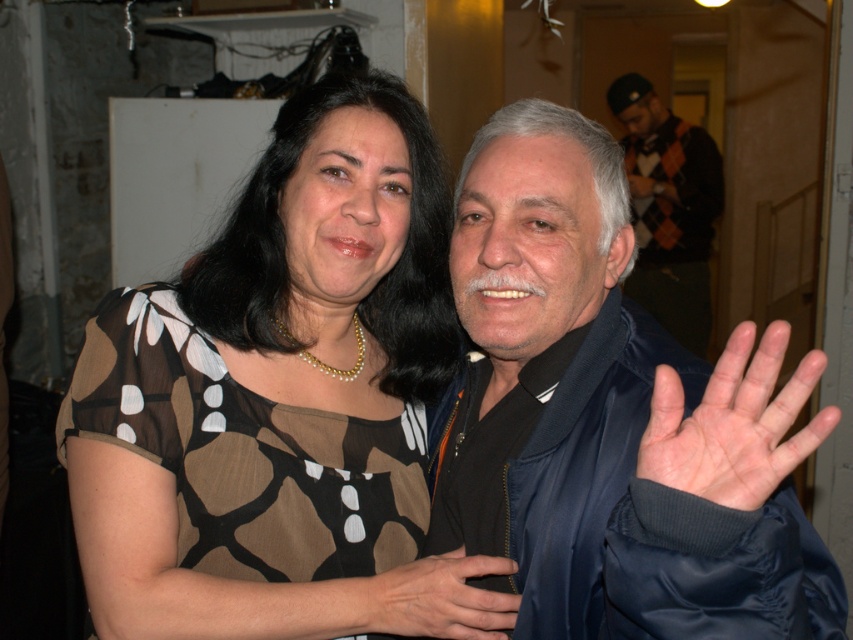
Question: Which object appears farthest from the camera in this image?

Choices:
 (A) brown dotted dress at center
 (B) pale skin palm at center
 (C) satin blue jacket at right
 (D) smooth black hand at center

Answer: (D)

Question: Is pale skin palm at center positioned at the back of argyle sweater at upper right?

Choices:
 (A) yes
 (B) no

Answer: (B)

Question: Which point is closer to the camera?

Choices:
 (A) pale skin palm at center
 (B) smooth black hand at center

Answer: (A)

Question: Does satin blue jacket at right have a larger size compared to argyle sweater at upper right?

Choices:
 (A) yes
 (B) no

Answer: (B)

Question: Which object is positioned farthest from the pale skin palm at center?

Choices:
 (A) satin blue jacket at right
 (B) argyle sweater at upper right
 (C) smooth black hand at center

Answer: (B)

Question: In this image, where is brown dotted dress at center located relative to argyle sweater at upper right?

Choices:
 (A) left
 (B) right

Answer: (A)